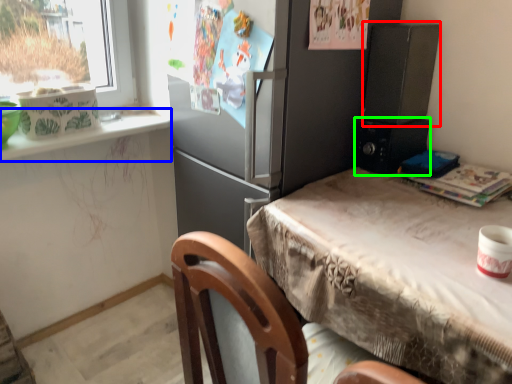
Question: Which is farther away from appliance (highlighted by a red box)? window sill (highlighted by a blue box) or appliance (highlighted by a green box)?

Choices:
 (A) window sill
 (B) appliance

Answer: (A)